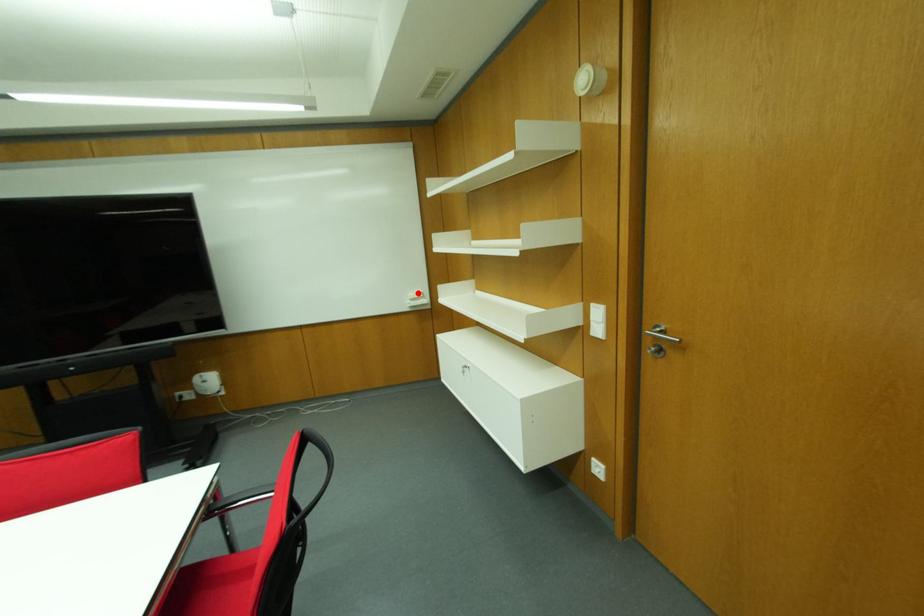
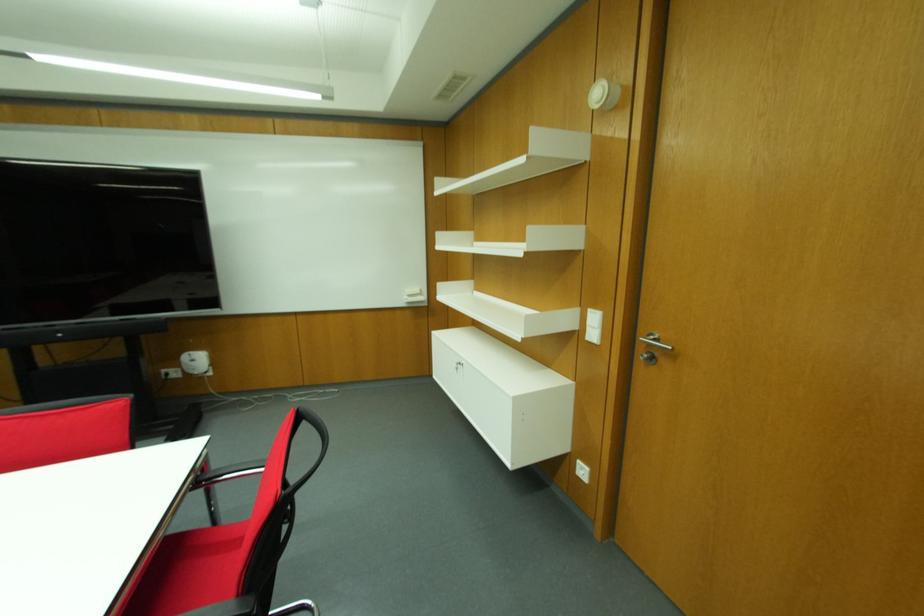
In the second image, find the point that corresponds to the highlighted location in the first image.

(416, 291)